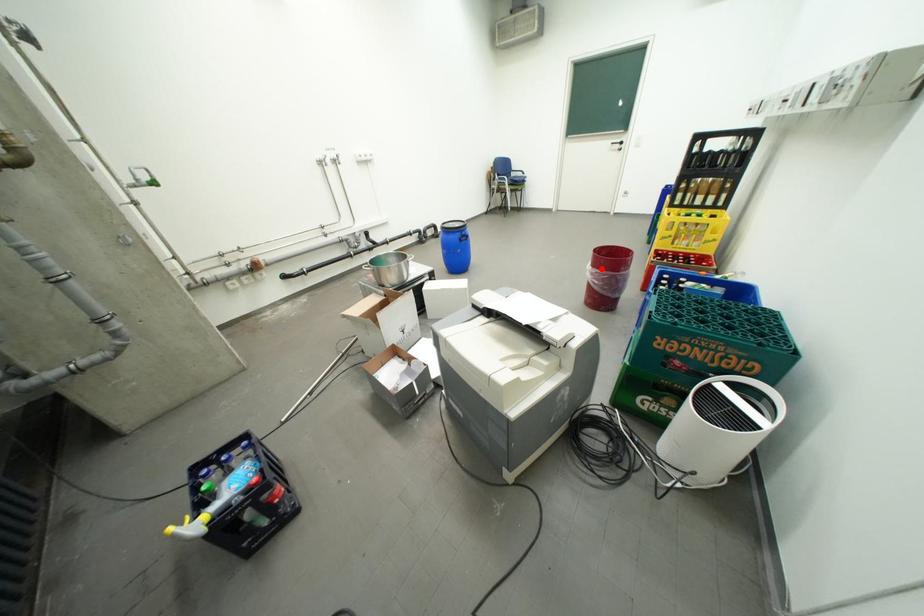
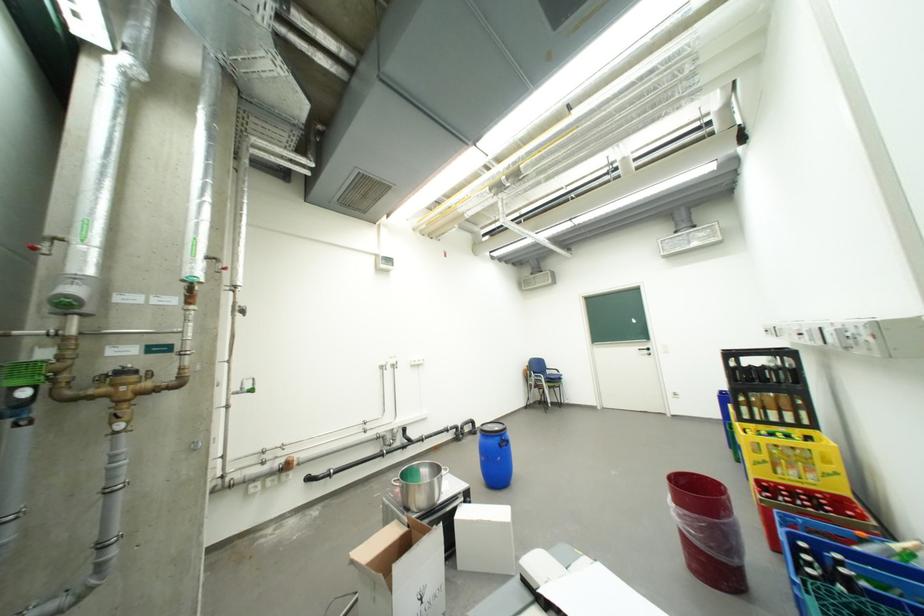
In the second image, find the point that corresponds to the highlighted location in the first image.

(685, 507)